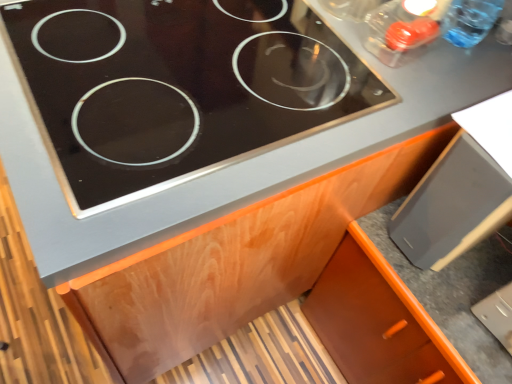
Where is `free space in front of transparent plastic bottle at upper right`? Image resolution: width=512 pixels, height=384 pixels. free space in front of transparent plastic bottle at upper right is located at coordinates (451, 78).